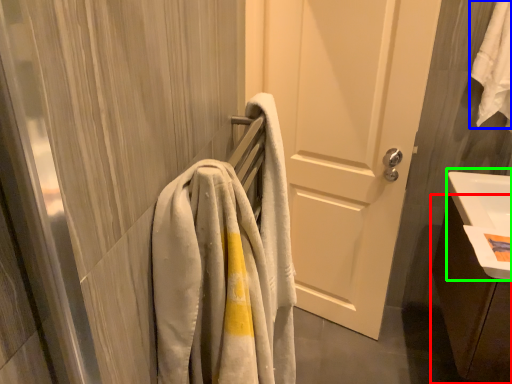
Question: Considering the real-world distances, which object is farthest from bathroom cabinet (highlighted by a red box)? bath towel (highlighted by a blue box) or sink (highlighted by a green box)?

Choices:
 (A) bath towel
 (B) sink

Answer: (A)